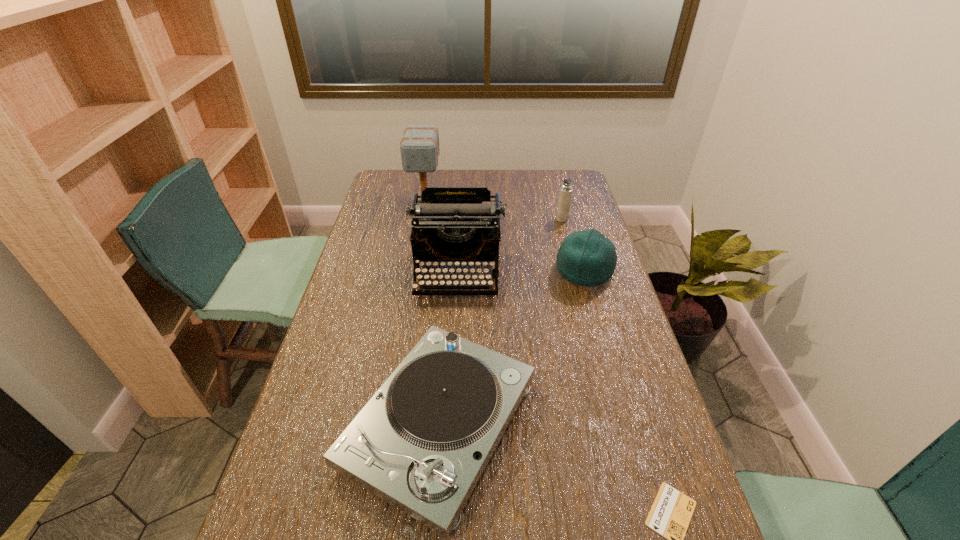
Find the location of a particular element. The height and width of the screenshot is (540, 960). thermos bottle present at the right edge is located at coordinates (565, 194).

I want to click on beanie located in the right edge section of the desktop, so click(587, 258).

This screenshot has height=540, width=960. I want to click on object present at the far left corner, so click(x=419, y=147).

I want to click on free location at the far edge, so click(x=440, y=180).

Identify the location of vacant space at the left edge of the desktop. The height and width of the screenshot is (540, 960). (371, 226).

This screenshot has width=960, height=540. What are the coordinates of `vacant area at the right edge` in the screenshot? It's located at (656, 434).

The image size is (960, 540). I want to click on free point between the typewriter and the fifth nearest object, so click(510, 246).

Image resolution: width=960 pixels, height=540 pixels. Find the location of `unoccupied position between the beanie and the fifth shortest object`. unoccupied position between the beanie and the fifth shortest object is located at coordinates (521, 272).

I want to click on vacant area between the beanie and the second tallest object, so click(521, 272).

Identify which object is located as the fourth nearest to the beanie. Please provide its 2D coordinates. Your answer should be formatted as a tuple, i.e. [(x, y)], where the tuple contains the x and y coordinates of a point satisfying the conditions above.

[(419, 147)]